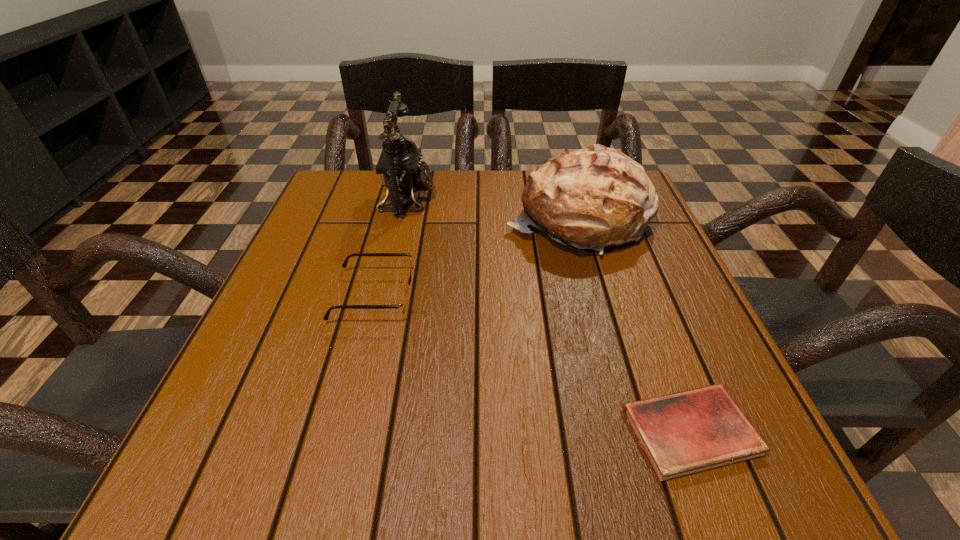
Find the location of `telephone located in the far edge section of the desktop`. telephone located in the far edge section of the desktop is located at coordinates (399, 164).

The image size is (960, 540). I want to click on bread that is at the far edge, so click(x=591, y=198).

Locate an element on the screen. Image resolution: width=960 pixels, height=540 pixels. object present at the near edge is located at coordinates (683, 433).

The image size is (960, 540). I want to click on telephone that is at the left edge, so click(399, 164).

The image size is (960, 540). Find the location of `spectacles located in the left edge section of the desktop`. spectacles located in the left edge section of the desktop is located at coordinates (403, 304).

Locate an element on the screen. The height and width of the screenshot is (540, 960). bread situated at the right edge is located at coordinates (591, 198).

Locate an element on the screen. The width and height of the screenshot is (960, 540). diary that is at the right edge is located at coordinates (683, 433).

Image resolution: width=960 pixels, height=540 pixels. Find the location of `object at the far left corner`. object at the far left corner is located at coordinates (399, 164).

Find the location of a particular element. object at the far right corner is located at coordinates (591, 198).

Identify the location of object that is positioned at the near right corner. point(683,433).